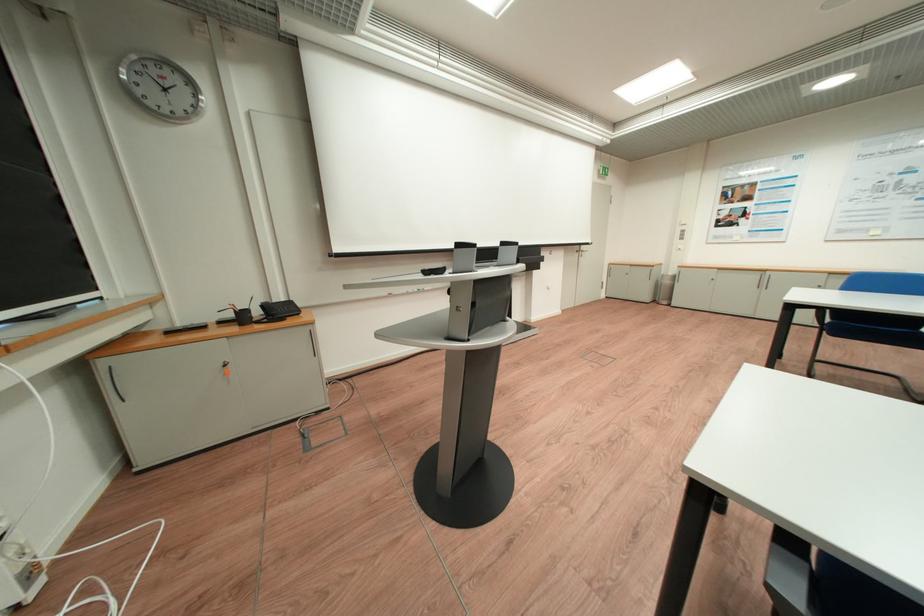
Identify the location of metal door handle. Image resolution: width=924 pixels, height=616 pixels. (114, 384).